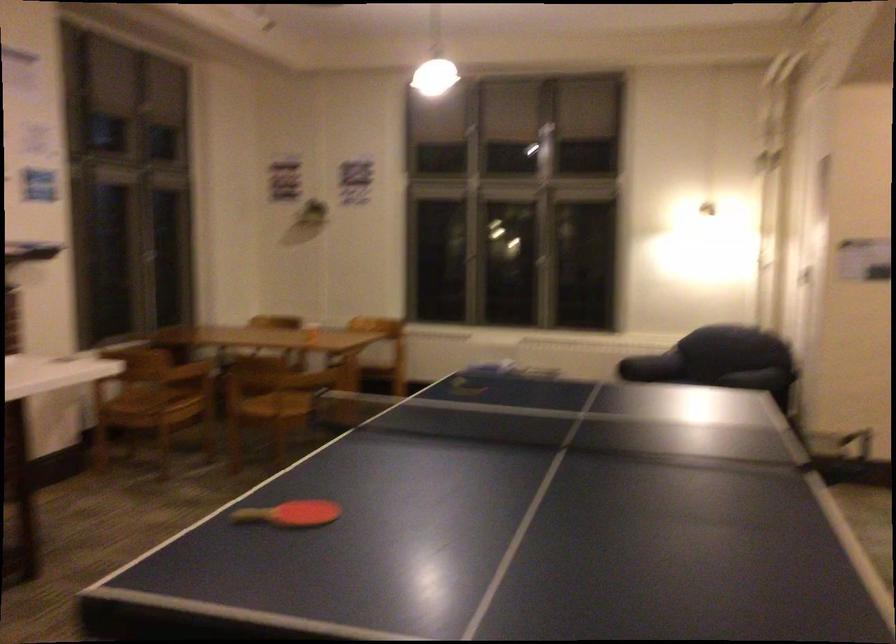
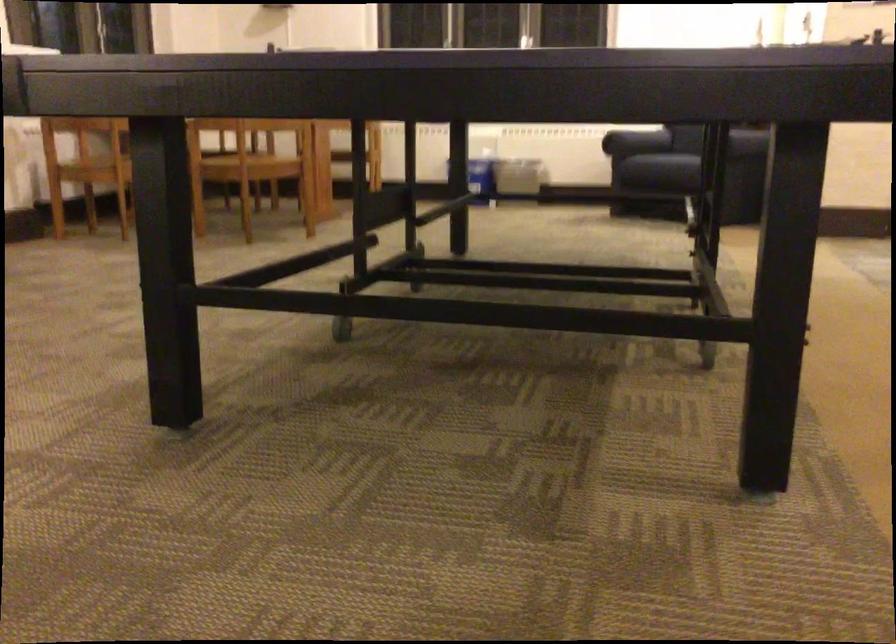
In the second image, find the point that corresponds to the point at 285,401 in the first image.

(248, 160)